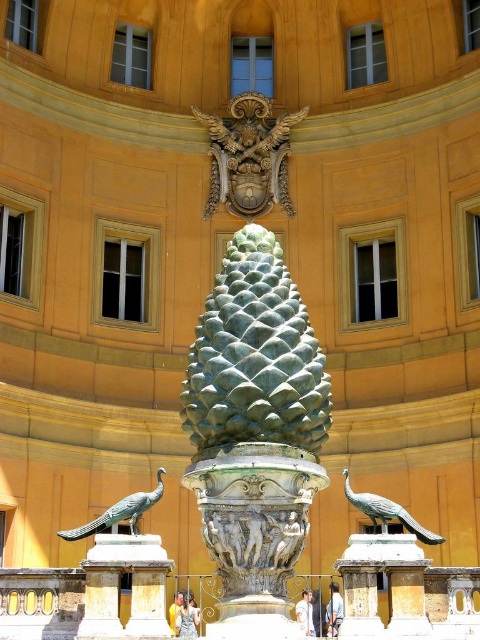
Identify the location of gold/gilded wood carving at upper center. The image size is (480, 640). (249, 156).

Is gold/gilded wood carving at upper center taller than polished bronze peacock at lower left?

Indeed, gold/gilded wood carving at upper center has a greater height compared to polished bronze peacock at lower left.

I want to click on gold/gilded wood carving at upper center, so click(x=249, y=156).

Describe the element at coordinates (254, 355) in the screenshot. The image size is (480, 640). I see `green patina stone pine cone at center` at that location.

Is green patina stone pine cone at center positioned in front of gold/gilded wood carving at upper center?

Yes, it is.

Measure the distance between green patina stone pine cone at center and camera.

They are 39.88 meters apart.

This screenshot has width=480, height=640. Find the location of `green patina stone pine cone at center`. green patina stone pine cone at center is located at coordinates (254, 355).

Identify the location of polished bronze peacock at lower left. This screenshot has height=640, width=480. (120, 513).

Is polished bronze peacock at lower left taller than polished bronze peacock at lower right?

Indeed, polished bronze peacock at lower left has a greater height compared to polished bronze peacock at lower right.

Where is `polished bronze peacock at lower left`? polished bronze peacock at lower left is located at coordinates (120, 513).

Locate an element on the screen. Image resolution: width=480 pixels, height=640 pixels. polished bronze peacock at lower left is located at coordinates (120, 513).